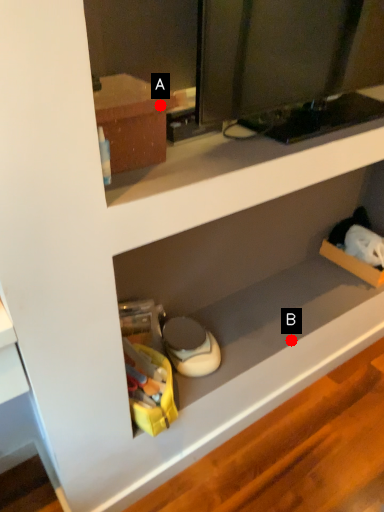
Question: Two points are circled on the image, labeled by A and B beside each circle. Which point is closer to the camera?

Choices:
 (A) A is closer
 (B) B is closer

Answer: (A)